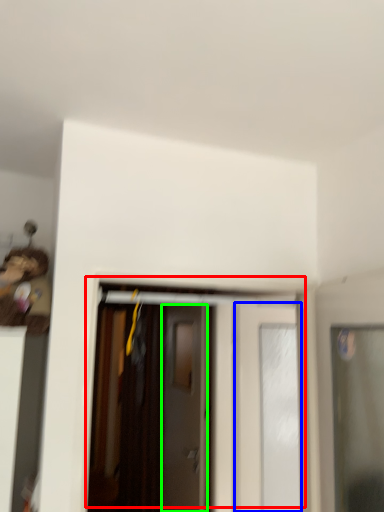
Question: Based on their relative distances, which object is farther from door (highlighted by a red box)? Choose from door (highlighted by a blue box) and door (highlighted by a green box).

Choices:
 (A) door
 (B) door

Answer: (A)